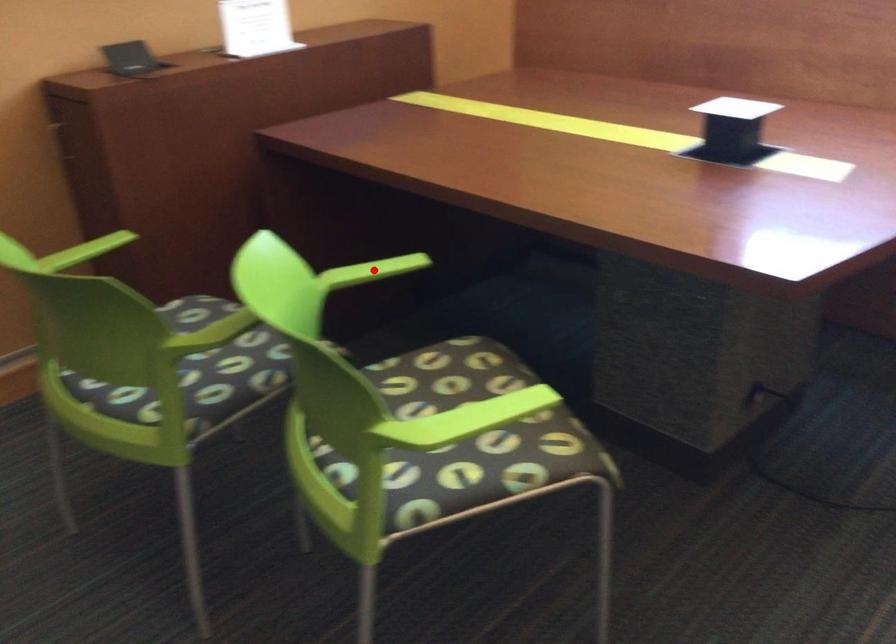
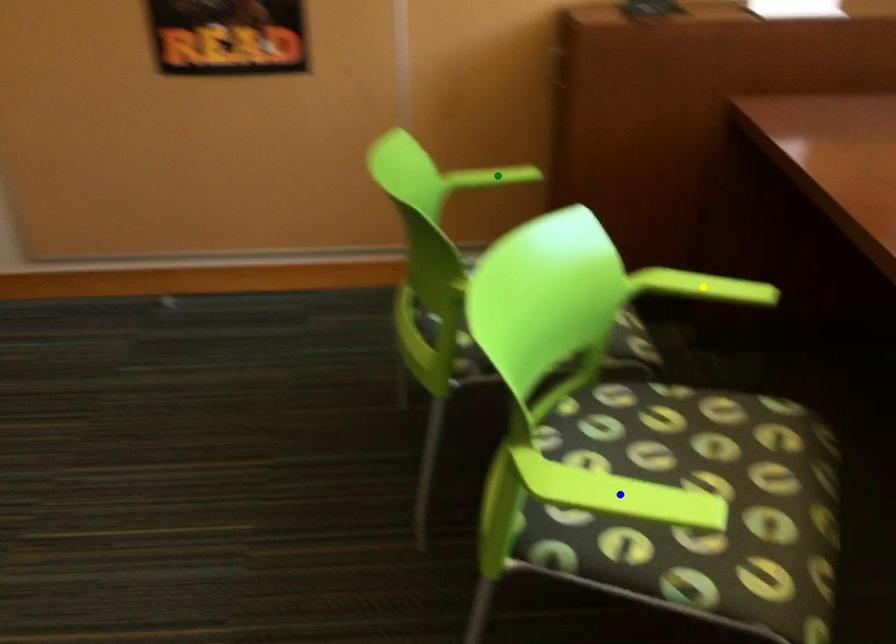
Question: I am providing you with two images of the same scene from different viewpoints. A red point is marked on the first image. You are given multiple points on the second image. In image 2, which mark is for the same physical point as the one in image 1?

Choices:
 (A) blue point
 (B) yellow point
 (C) green point

Answer: (B)